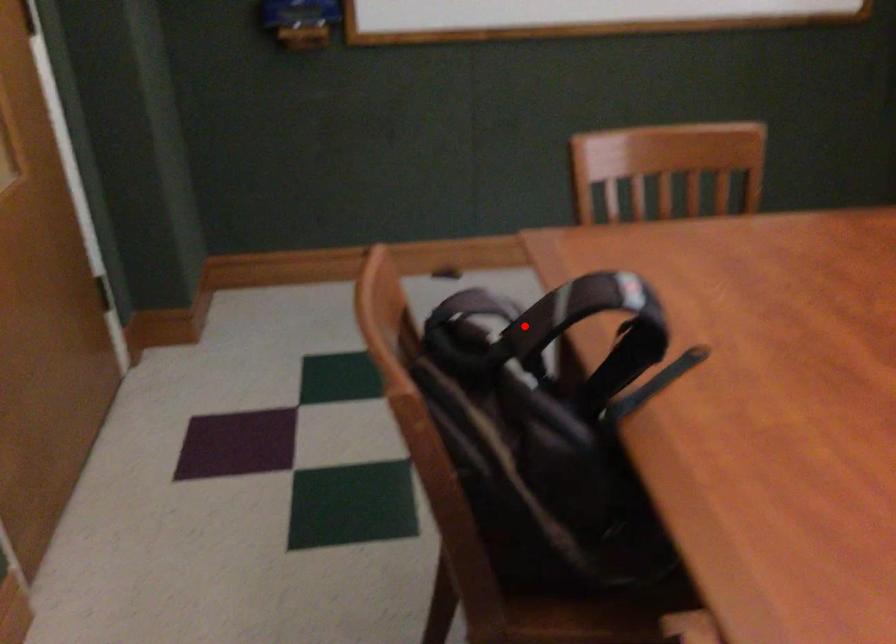
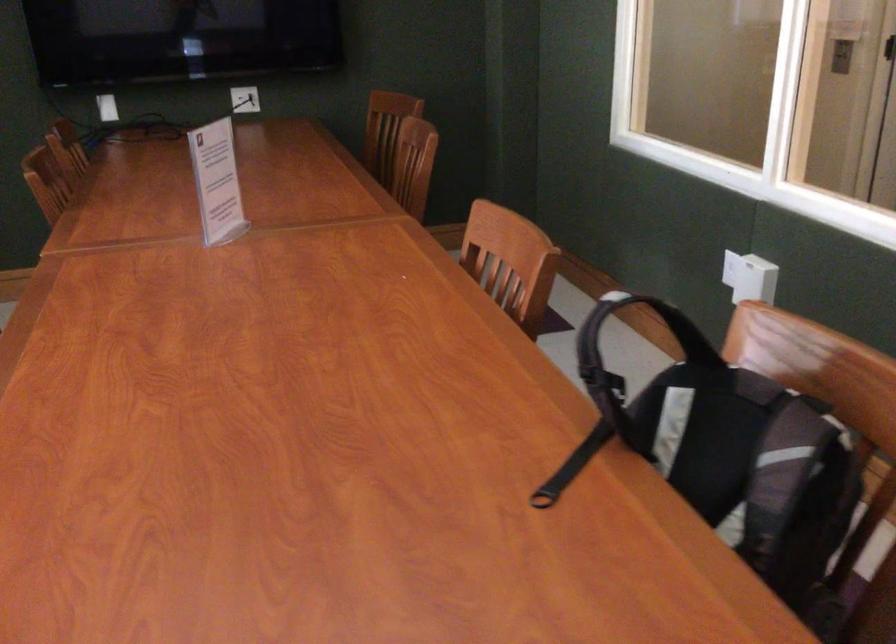
Find the pixel in the second image that matches the highlighted location in the first image.

(690, 337)